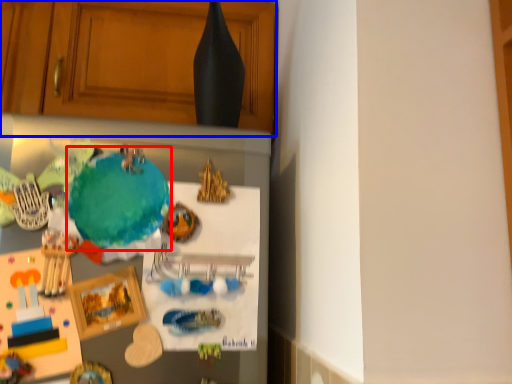
Question: Which object is closer to the camera taking this photo, teal (highlighted by a red box) or cabinetry (highlighted by a blue box)?

Choices:
 (A) teal
 (B) cabinetry

Answer: (A)